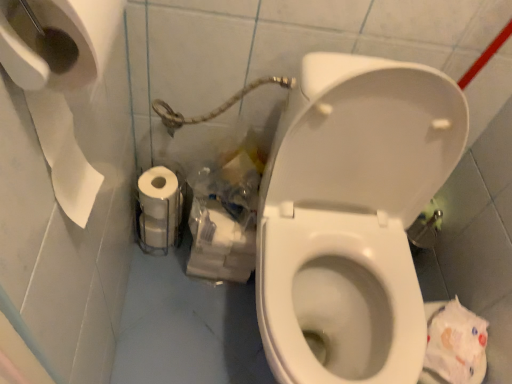
Question: From the image's perspective, is translucent plastic bag at lower center beneath white glossy toilet at center?

Choices:
 (A) no
 (B) yes

Answer: (A)

Question: Considering the relative sizes of translucent plastic bag at lower center and white glossy toilet at center in the image provided, is translucent plastic bag at lower center shorter than white glossy toilet at center?

Choices:
 (A) yes
 (B) no

Answer: (A)

Question: Is translucent plastic bag at lower center to the left of white glossy toilet at center from the viewer's perspective?

Choices:
 (A) no
 (B) yes

Answer: (B)

Question: Is translucent plastic bag at lower center in front of white glossy toilet at center?

Choices:
 (A) yes
 (B) no

Answer: (B)

Question: Is translucent plastic bag at lower center further to camera compared to white glossy toilet at center?

Choices:
 (A) yes
 (B) no

Answer: (A)

Question: Based on their sizes in the image, would you say white glossy toilet at center is bigger or smaller than white matte toilet paper at lower left?

Choices:
 (A) small
 (B) big

Answer: (B)

Question: From a real-world perspective, is white glossy toilet at center above or below white matte toilet paper at lower left?

Choices:
 (A) above
 (B) below

Answer: (A)

Question: From their relative heights in the image, would you say white glossy toilet at center is taller or shorter than white matte toilet paper at lower left?

Choices:
 (A) short
 (B) tall

Answer: (B)

Question: From the image's perspective, is white glossy toilet at center positioned above or below white matte toilet paper at lower left?

Choices:
 (A) below
 (B) above

Answer: (A)

Question: Relative to white glossy toilet at center, is translucent plastic bag at lower center in front or behind?

Choices:
 (A) behind
 (B) front

Answer: (A)

Question: In terms of size, does translucent plastic bag at lower center appear bigger or smaller than white glossy toilet at center?

Choices:
 (A) big
 (B) small

Answer: (B)

Question: From a real-world perspective, is translucent plastic bag at lower center physically located above or below white glossy toilet at center?

Choices:
 (A) below
 (B) above

Answer: (A)

Question: Is translucent plastic bag at lower center inside or outside of white glossy toilet at center?

Choices:
 (A) inside
 (B) outside

Answer: (B)

Question: Based on their sizes in the image, would you say white matte toilet paper at lower left is bigger or smaller than translucent plastic bag at lower center?

Choices:
 (A) small
 (B) big

Answer: (A)

Question: Is point (159, 195) positioned closer to the camera than point (223, 276)?

Choices:
 (A) closer
 (B) farther

Answer: (A)